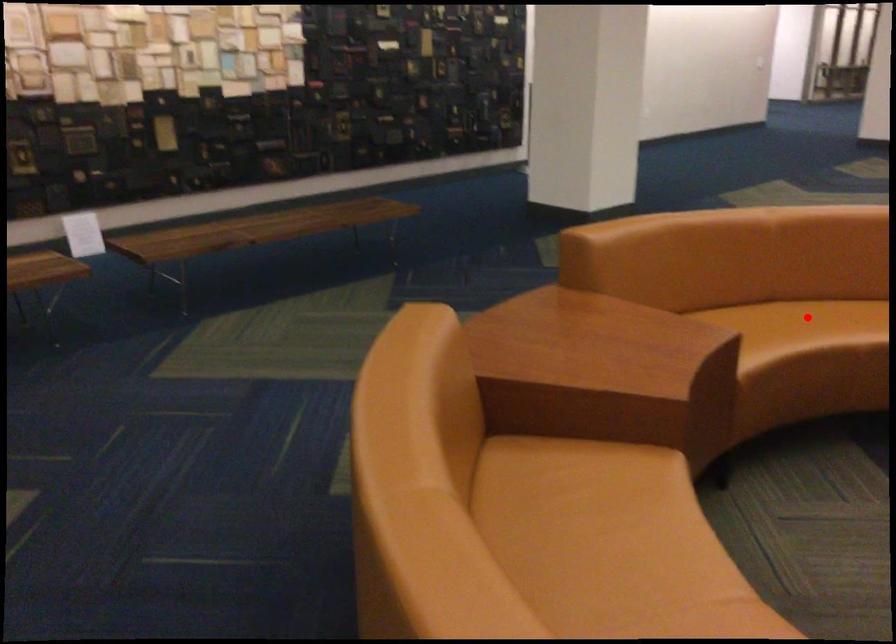
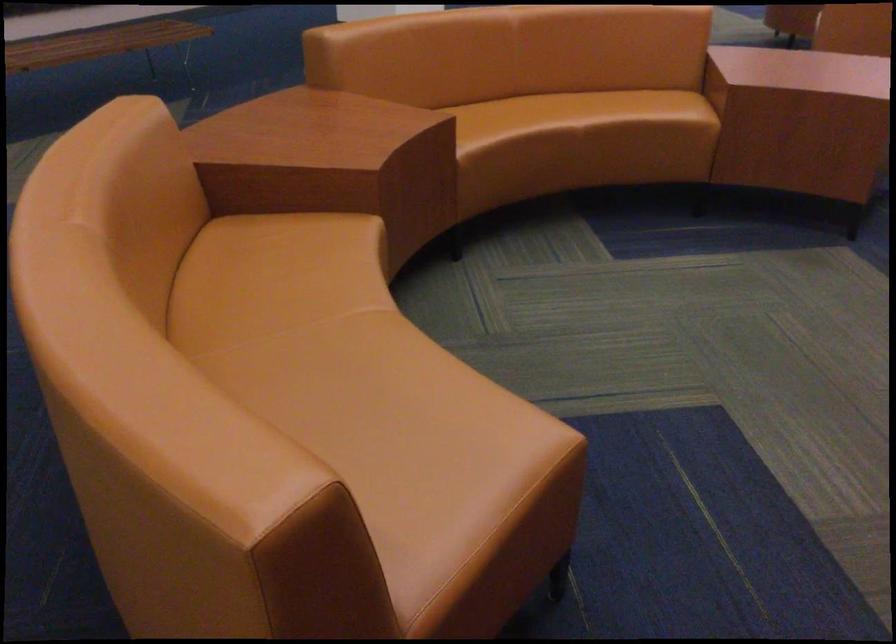
Locate, in the second image, the point that corresponds to the highlighted location in the first image.

(538, 113)